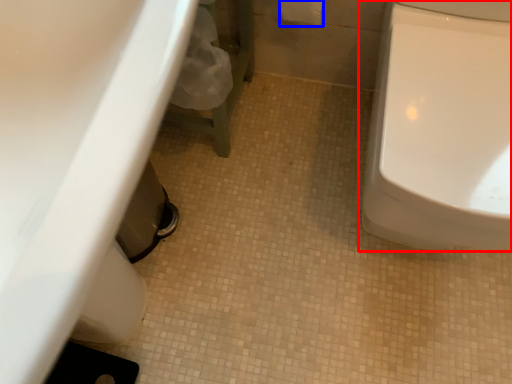
Question: Which point is further to the camera, toilet (highlighted by a red box) or toilet paper (highlighted by a blue box)?

Choices:
 (A) toilet
 (B) toilet paper

Answer: (B)